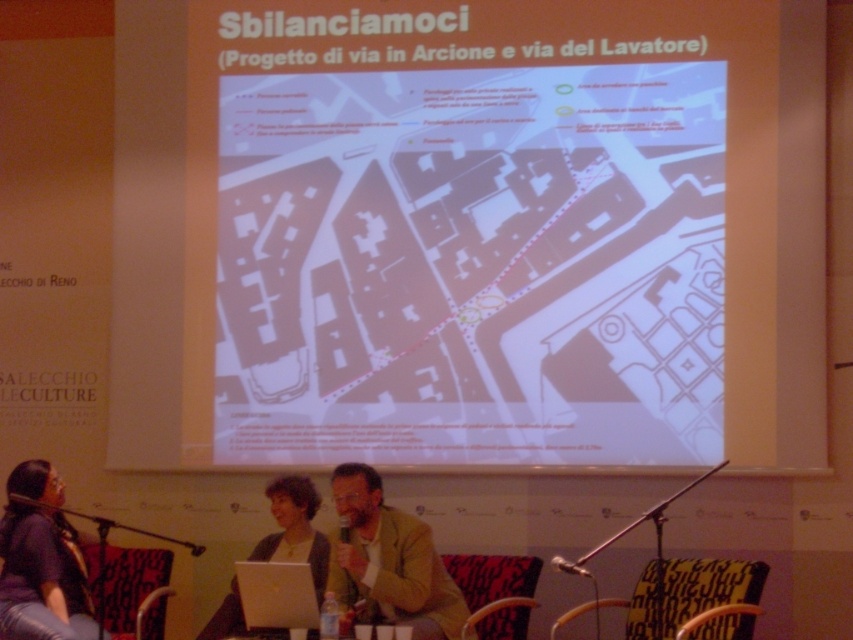
Does blue fabric chair at lower left have a lesser width compared to red fabric chair at lower center?

Incorrect, blue fabric chair at lower left's width is not less than red fabric chair at lower center's.

Where is `blue fabric chair at lower left`? This screenshot has height=640, width=853. blue fabric chair at lower left is located at coordinates (131, 582).

Is point (144, 577) farther from viewer compared to point (480, 605)?

That is True.

What are the coordinates of `blue fabric chair at lower left` in the screenshot? It's located at (131, 582).

Who is lower down, blue fabric chair at lower left or black plastic microphone at lower center?

Positioned lower is blue fabric chair at lower left.

Who is more distant from viewer, (126, 561) or (338, 522)?

Positioned behind is point (126, 561).

The height and width of the screenshot is (640, 853). Find the location of `blue fabric chair at lower left`. blue fabric chair at lower left is located at coordinates (131, 582).

Does yellow fabric chair at lower center have a lesser width compared to white plastic table at lower center?

Correct, yellow fabric chair at lower center's width is less than white plastic table at lower center's.

Which is above, yellow fabric chair at lower center or white plastic table at lower center?

yellow fabric chair at lower center

Which is behind, point (688, 612) or point (405, 636)?

The point (688, 612) is more distant.

In order to click on yellow fabric chair at lower center in this screenshot , I will do `click(688, 593)`.